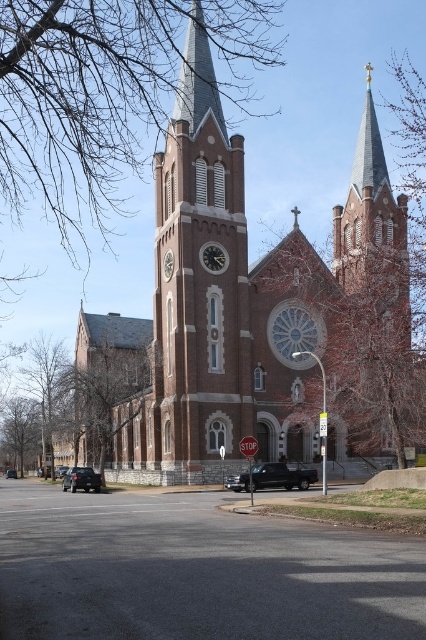
Question: Which object is farther from the camera taking this photo?

Choices:
 (A) smooth gray steeple at upper center
 (B) brown brick church at center

Answer: (A)

Question: Does brown brick clock tower at center have a smaller size compared to smooth gray steeple at upper center?

Choices:
 (A) no
 (B) yes

Answer: (A)

Question: Is smooth gray steeple at upper center thinner than black matte truck at center?

Choices:
 (A) yes
 (B) no

Answer: (B)

Question: Which is farther from the black matte truck at lower center?

Choices:
 (A) gold metallic clock at center
 (B) brown brick church at center
 (C) matte black clock at center

Answer: (A)

Question: Which object is the farthest from the brown brick church at center?

Choices:
 (A) gold metallic clock at center
 (B) brown brick clock tower at center
 (C) black matte truck at lower center

Answer: (C)

Question: Is smooth gray steeple at upper center to the right of black matte truck at lower left from the viewer's perspective?

Choices:
 (A) no
 (B) yes

Answer: (B)